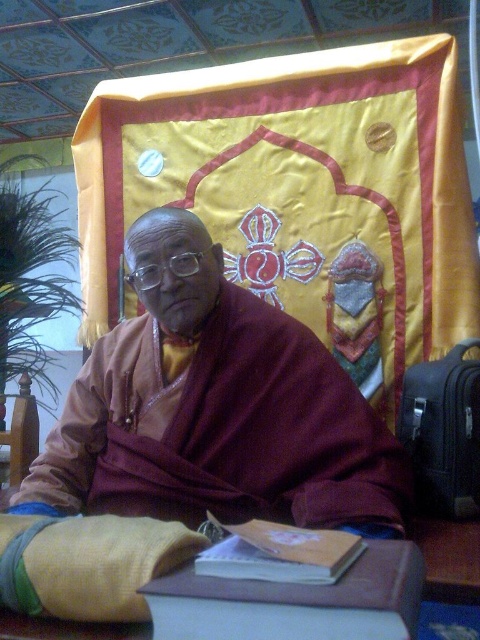
Question: Can you confirm if maroon woolen robe at center is bigger than brown leather table at center?

Choices:
 (A) yes
 (B) no

Answer: (A)

Question: Which of these objects is positioned closest to the matte brown book at center?

Choices:
 (A) brown leather table at center
 (B) maroon woolen robe at center

Answer: (A)

Question: Considering the real-world distances, which object is closest to the maroon woolen robe at center?

Choices:
 (A) brown leather table at center
 (B) matte brown book at center

Answer: (B)

Question: Does brown leather table at center appear on the left side of matte brown book at center?

Choices:
 (A) yes
 (B) no

Answer: (B)

Question: Can you confirm if maroon woolen robe at center is wider than matte brown book at center?

Choices:
 (A) yes
 (B) no

Answer: (A)

Question: Which of the following is the closest to the observer?

Choices:
 (A) (285, 529)
 (B) (228, 294)

Answer: (A)